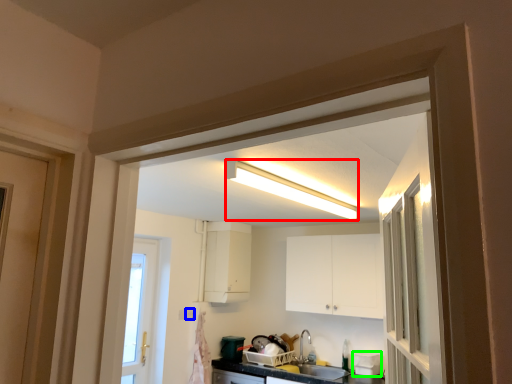
Question: Considering the real-world distances, which object is closest to light fixture (highlighted by a red box)? electric outlet (highlighted by a blue box) or appliance (highlighted by a green box).

Choices:
 (A) electric outlet
 (B) appliance

Answer: (B)